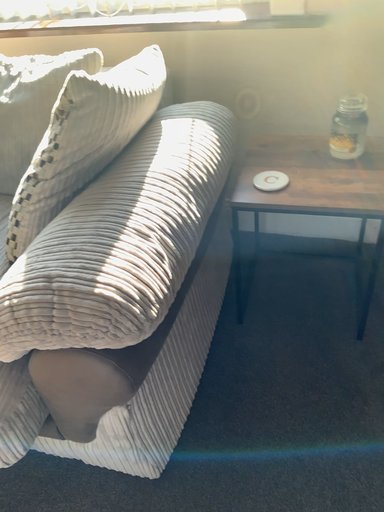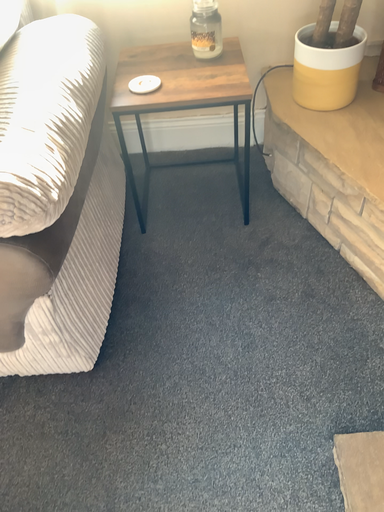
Question: How did the camera likely rotate when shooting the video?

Choices:
 (A) rotated right
 (B) rotated left

Answer: (A)